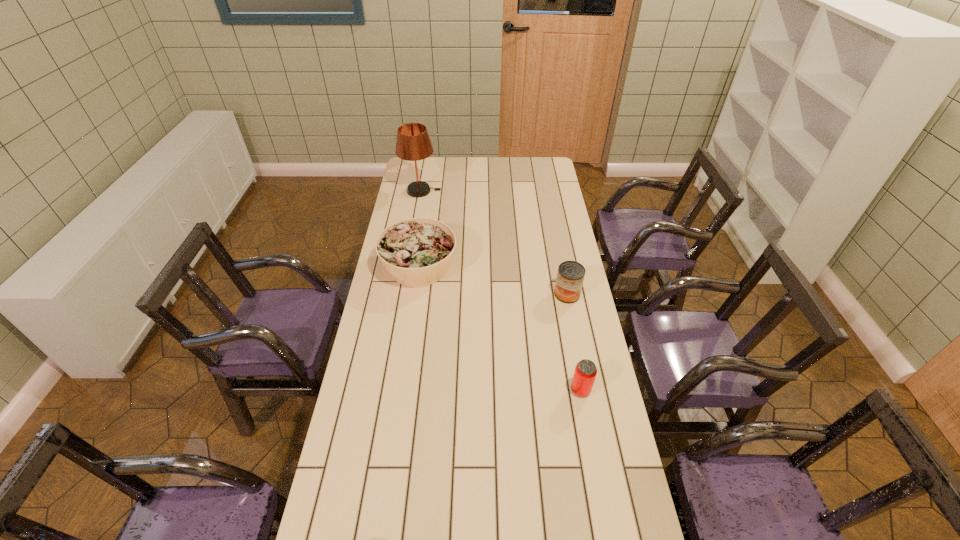
Locate an element on the screen. The image size is (960, 540). salad situated at the left edge is located at coordinates (417, 252).

Image resolution: width=960 pixels, height=540 pixels. In the image, there is a desktop. In order to click on vacant space at the far edge in this screenshot , I will do `click(516, 173)`.

You are a GUI agent. You are given a task and a screenshot of the screen. Output one action in this format:
    pyautogui.click(x=<x>, y=<y>)
    Task: Click on the vacant area at the left edge
    
    Given the screenshot: What is the action you would take?
    pyautogui.click(x=360, y=457)

Locate an element on the screen. The height and width of the screenshot is (540, 960). vacant space at the right edge of the desktop is located at coordinates (592, 432).

The image size is (960, 540). I want to click on vacant region at the far left corner of the desktop, so click(407, 168).

Image resolution: width=960 pixels, height=540 pixels. Identify the location of free space between the farther can and the salad. pos(493,280).

This screenshot has height=540, width=960. Identify the location of free space between the farther can and the salad. (493, 280).

Where is `free space between the nearer can and the farther can`? Image resolution: width=960 pixels, height=540 pixels. free space between the nearer can and the farther can is located at coordinates [574, 342].

Where is `vacant space in between the nearest object and the salad`? This screenshot has width=960, height=540. vacant space in between the nearest object and the salad is located at coordinates (500, 328).

I want to click on empty space that is in between the salad and the nearer can, so click(x=500, y=328).